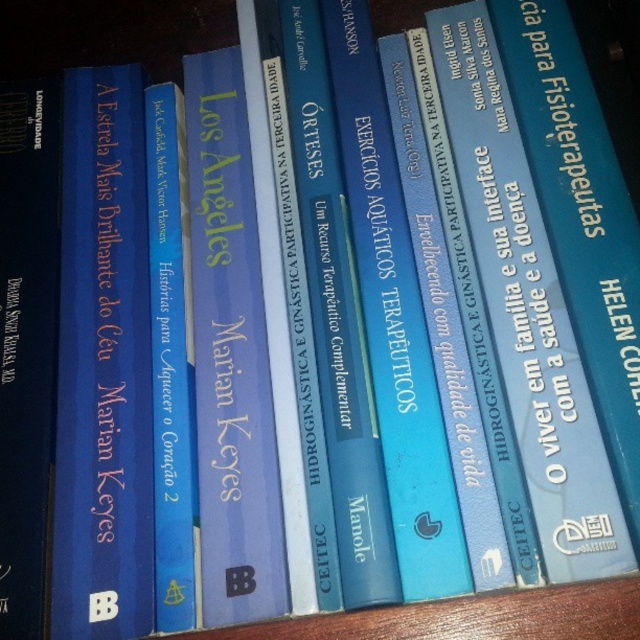
Which is behind, point (138, 499) or point (550, 147)?

The point (550, 147) is more distant.

Is blue hardcover book at left positioned at the back of blue hardcover book at center?

Yes, it is.

In order to click on blue hardcover book at left in this screenshot , I will do `click(102, 365)`.

Where is `blue hardcover book at left`? blue hardcover book at left is located at coordinates (102, 365).

Is blue hardcover book at left above matte blue book at center?

Actually, blue hardcover book at left is below matte blue book at center.

Which is below, blue hardcover book at left or matte blue book at center?

blue hardcover book at left is below.

Does point (113, 512) come closer to viewer compared to point (218, 592)?

No, it is behind (218, 592).

The width and height of the screenshot is (640, 640). I want to click on blue hardcover book at left, so click(x=102, y=365).

Is point (252, 252) positioned after point (515, 6)?

No, it is in front of (515, 6).

Does matte blue book at center appear over blue hardcover book at center?

Actually, matte blue book at center is below blue hardcover book at center.

Find the location of a particular element. This screenshot has width=640, height=640. matte blue book at center is located at coordinates (230, 355).